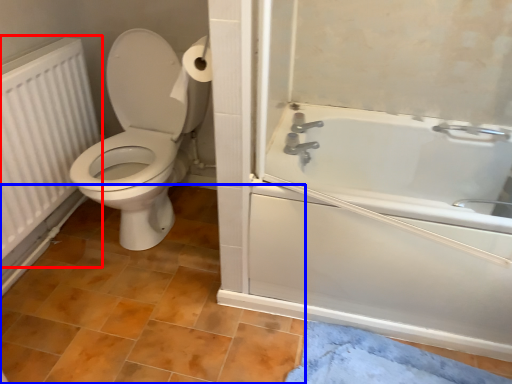
Question: Which object appears farthest to the camera in this image, radiator (highlighted by a red box) or tile (highlighted by a blue box)?

Choices:
 (A) radiator
 (B) tile

Answer: (A)